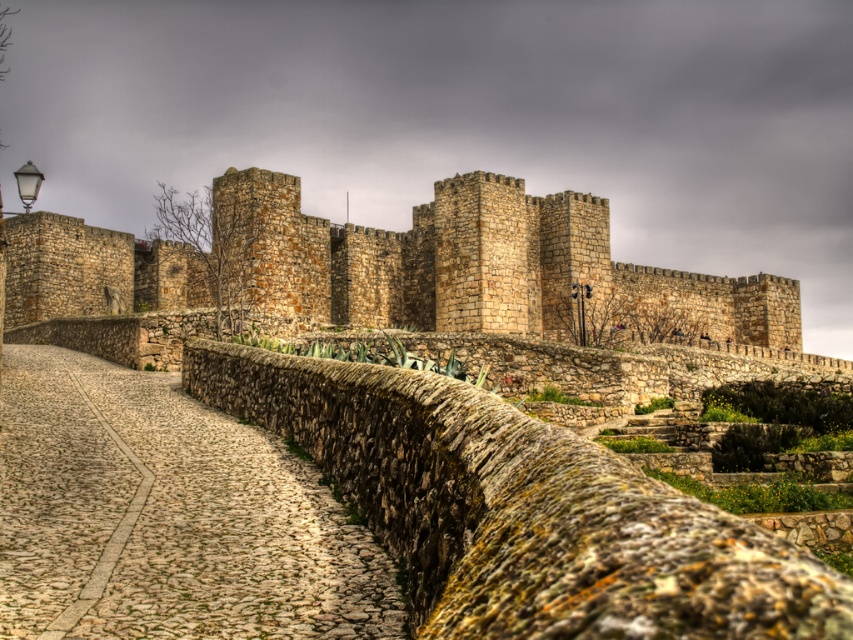
Does green mossy stone wall at center have a smaller size compared to cobblestone path at center?

No, green mossy stone wall at center is not smaller than cobblestone path at center.

Find the location of a particular element. green mossy stone wall at center is located at coordinates (520, 509).

Image resolution: width=853 pixels, height=640 pixels. Find the location of `green mossy stone wall at center`. green mossy stone wall at center is located at coordinates (520, 509).

Is point (305, 579) positioned after point (712, 328)?

No, it is in front of (712, 328).

Measure the distance between cobblestone path at center and rustic stone castle at center.

A distance of 56.53 meters exists between cobblestone path at center and rustic stone castle at center.

The height and width of the screenshot is (640, 853). In order to click on cobblestone path at center in this screenshot , I will do `click(169, 515)`.

What are the coordinates of `cobblestone path at center` in the screenshot? It's located at (169, 515).

In the scene shown: Who is higher up, green mossy stone wall at center or rustic stone castle at center?

rustic stone castle at center

Describe the element at coordinates (520, 509) in the screenshot. I see `green mossy stone wall at center` at that location.

Find the location of a particular element. green mossy stone wall at center is located at coordinates (520, 509).